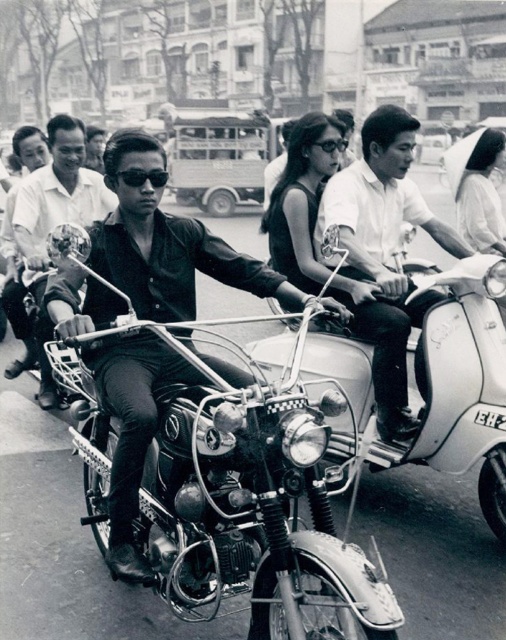
You are a photographer analyzing this black and white image. You notice the shiny chrome motorcycle at center and the black plastic goggles at center. Which object would appear larger in your viewfinder?

The shiny chrome motorcycle at center would appear larger in the viewfinder because it is closer to the viewer than the black plastic goggles at center.